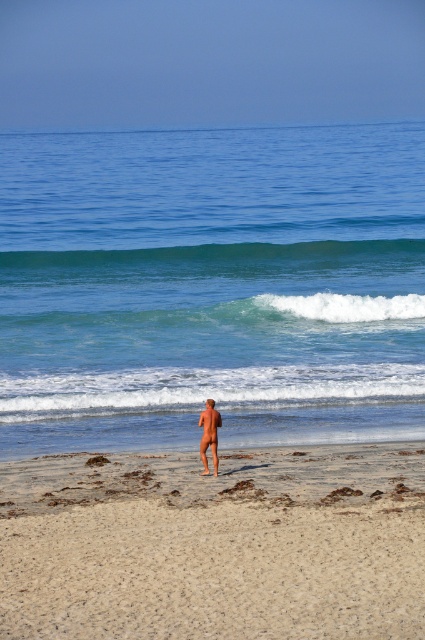
Question: Which object is farther from the camera taking this photo?

Choices:
 (A) smooth tan skin at center
 (B) smooth sand at center
 (C) blue water at center

Answer: (C)

Question: Can you confirm if blue water at center is smaller than smooth tan skin at center?

Choices:
 (A) yes
 (B) no

Answer: (B)

Question: Does blue water at center come in front of smooth tan skin at center?

Choices:
 (A) yes
 (B) no

Answer: (B)

Question: Which point is farther to the camera?

Choices:
 (A) blue water at center
 (B) smooth sand at center

Answer: (A)

Question: Which object is the farthest from the smooth sand at center?

Choices:
 (A) blue water at center
 (B) smooth tan skin at center

Answer: (A)

Question: Is smooth sand at center bigger than smooth tan skin at center?

Choices:
 (A) no
 (B) yes

Answer: (B)